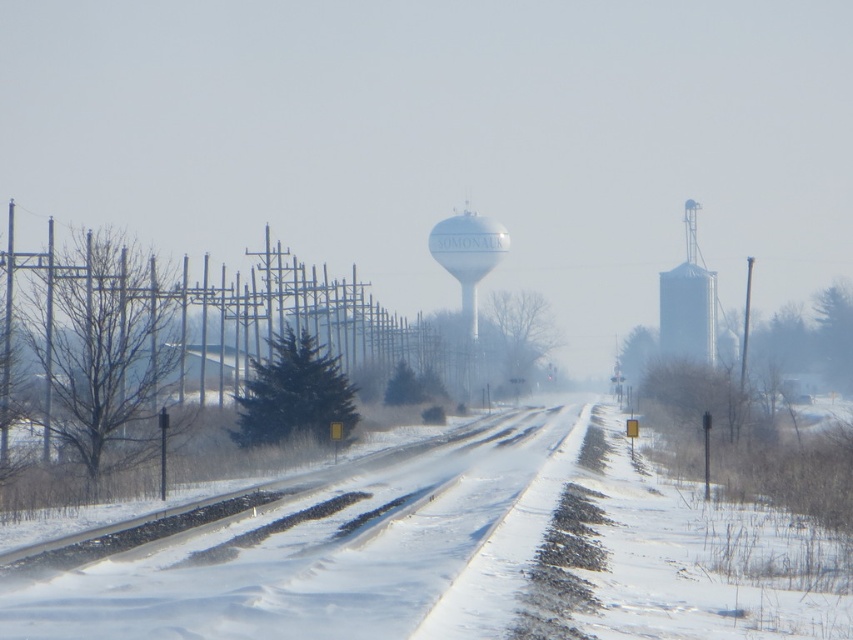
You are navigating a delivery truck and need to find the snowy asphalt road at center. According to the map, your current position is at point 0.867, 0.362. Can you reach the road from your current location?

The snowy asphalt road at center is located at point 0.862, so you are very close to the road and can easily reach it from your current position.

You are a delivery driver navigating through a rural winter area. You need to locate the white matte water tower at center. According to the scene, where would you find it relative to the snowy asphalt road at center?

The snowy asphalt road at center is to the right of the white matte water tower at center, so the white matte water tower at center is to the left of the snowy asphalt road at center.